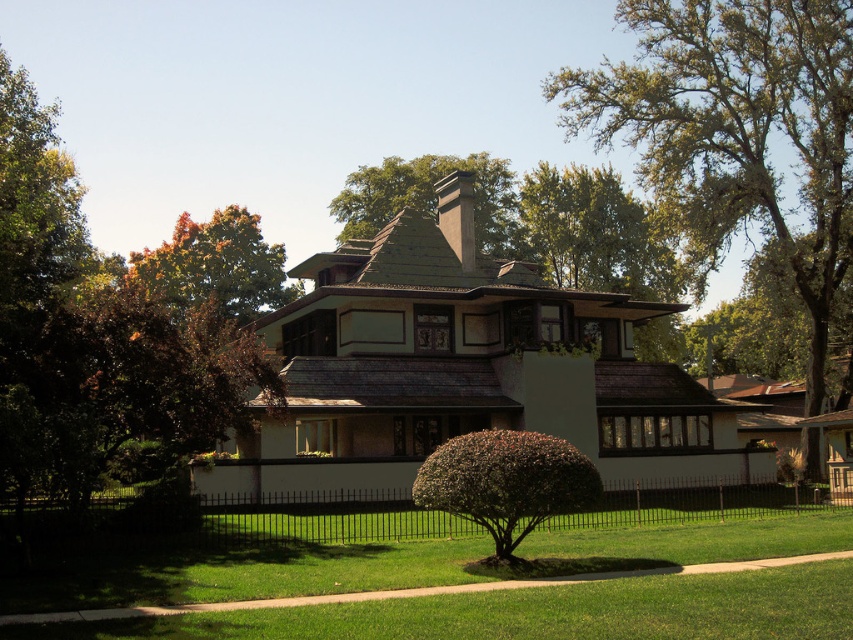
Is brown leafy tree at upper left smaller than green leafy tree at upper center?

Incorrect, brown leafy tree at upper left is not smaller in size than green leafy tree at upper center.

Does point (173, 256) come farther from viewer compared to point (483, 157)?

Yes.

Locate an element on the screen. brown leafy tree at upper left is located at coordinates (106, 330).

Does brown textured tree at upper center have a lesser width compared to green leafy tree at upper center?

In fact, brown textured tree at upper center might be wider than green leafy tree at upper center.

Can you confirm if brown textured tree at upper center is wider than green leafy tree at upper center?

Correct, the width of brown textured tree at upper center exceeds that of green leafy tree at upper center.

The image size is (853, 640). What do you see at coordinates (216, 266) in the screenshot?
I see `brown textured tree at upper center` at bounding box center [216, 266].

Find the location of a particular element. Image resolution: width=853 pixels, height=640 pixels. brown textured tree at upper center is located at coordinates tap(216, 266).

Which of these two, brown leafy tree at upper left or black wrought iron fence at center, stands shorter?

Standing shorter between the two is black wrought iron fence at center.

Between point (206, 339) and point (445, 536), which one is positioned behind?

The point (445, 536) is behind.

Who is more forward, (212, 225) or (376, 513)?

Point (376, 513) is more forward.

The image size is (853, 640). Find the location of `brown leafy tree at upper left`. brown leafy tree at upper left is located at coordinates (106, 330).